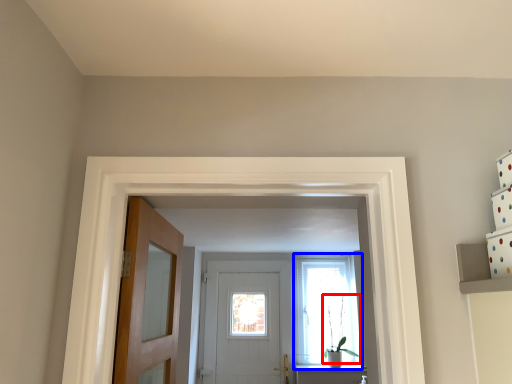
Question: Which of the following is the closest to the observer, plant (highlighted by a red box) or window (highlighted by a blue box)?

Choices:
 (A) plant
 (B) window

Answer: (A)